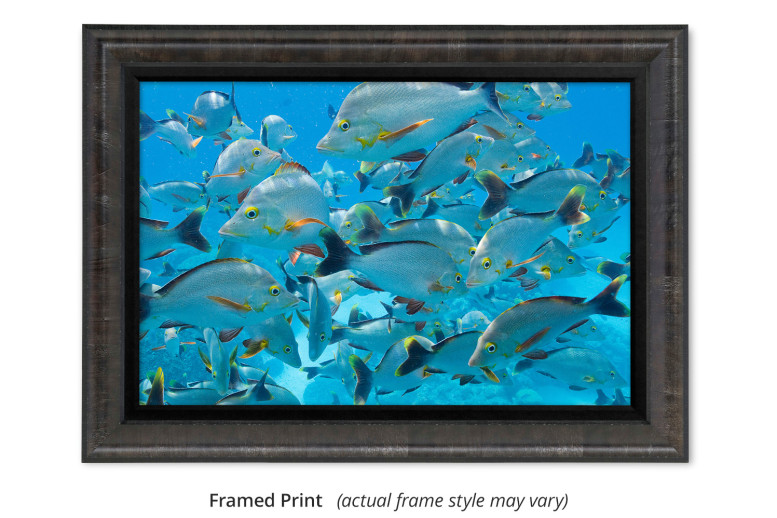
Where is `frame`? The image size is (777, 518). frame is located at coordinates (587, 462).